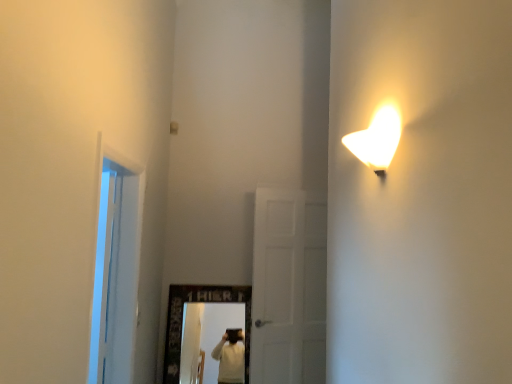
Question: Is transparent glass door at left taller than white matte door at center?

Choices:
 (A) no
 (B) yes

Answer: (A)

Question: Can you confirm if transparent glass door at left is shorter than white matte door at center?

Choices:
 (A) no
 (B) yes

Answer: (B)

Question: Is transparent glass door at left closer to camera compared to white matte door at center?

Choices:
 (A) no
 (B) yes

Answer: (B)

Question: Is the position of transparent glass door at left more distant than that of white matte door at center?

Choices:
 (A) yes
 (B) no

Answer: (B)

Question: Would you consider transparent glass door at left to be distant from white matte door at center?

Choices:
 (A) yes
 (B) no

Answer: (A)

Question: From the image's perspective, is transparent glass door at left above white matte door at center?

Choices:
 (A) yes
 (B) no

Answer: (A)

Question: Can you confirm if white matte door at center is wider than transparent glass door at left?

Choices:
 (A) no
 (B) yes

Answer: (A)

Question: Is white matte door at center thinner than transparent glass door at left?

Choices:
 (A) yes
 (B) no

Answer: (A)

Question: Is white matte door at center facing away from transparent glass door at left?

Choices:
 (A) no
 (B) yes

Answer: (A)

Question: From the image's perspective, is white matte door at center on top of transparent glass door at left?

Choices:
 (A) yes
 (B) no

Answer: (B)

Question: From a real-world perspective, is white matte door at center below transparent glass door at left?

Choices:
 (A) yes
 (B) no

Answer: (A)

Question: Considering the relative sizes of white matte door at center and transparent glass door at left in the image provided, is white matte door at center bigger than transparent glass door at left?

Choices:
 (A) no
 (B) yes

Answer: (A)

Question: Choose the correct answer: Is white matte door at center inside transparent glass door at left or outside it?

Choices:
 (A) inside
 (B) outside

Answer: (B)